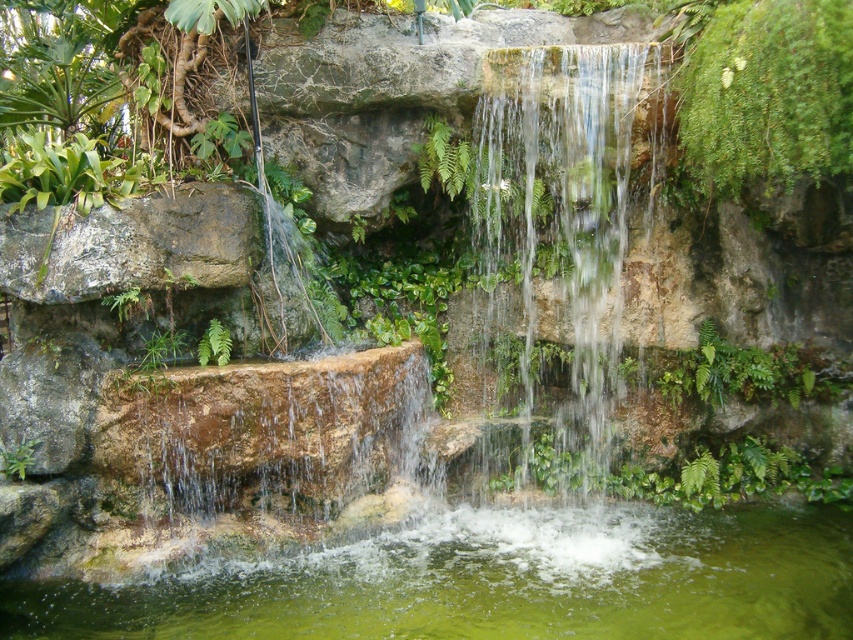
Which is above, clear water at center or green leafy fern at center?

clear water at center is higher up.

Does clear water at center have a lesser height compared to green leafy fern at center?

No.

Locate an element on the screen. The image size is (853, 640). clear water at center is located at coordinates (560, 234).

Image resolution: width=853 pixels, height=640 pixels. I want to click on clear water at center, so click(560, 234).

Does green leafy plant at center have a smaller size compared to green leafy fern at center?

No.

Who is more distant from viewer, (169, 337) or (219, 339)?

The point (219, 339) is more distant.

What do you see at coordinates (161, 348) in the screenshot? This screenshot has height=640, width=853. I see `green leafy plant at center` at bounding box center [161, 348].

The width and height of the screenshot is (853, 640). What are the coordinates of `green leafy plant at center` in the screenshot? It's located at (161, 348).

Between green liquid water at bottom and green leafy plant at center-left, which one appears on the left side from the viewer's perspective?

green leafy plant at center-left

Locate an element on the screen. green liquid water at bottom is located at coordinates (492, 580).